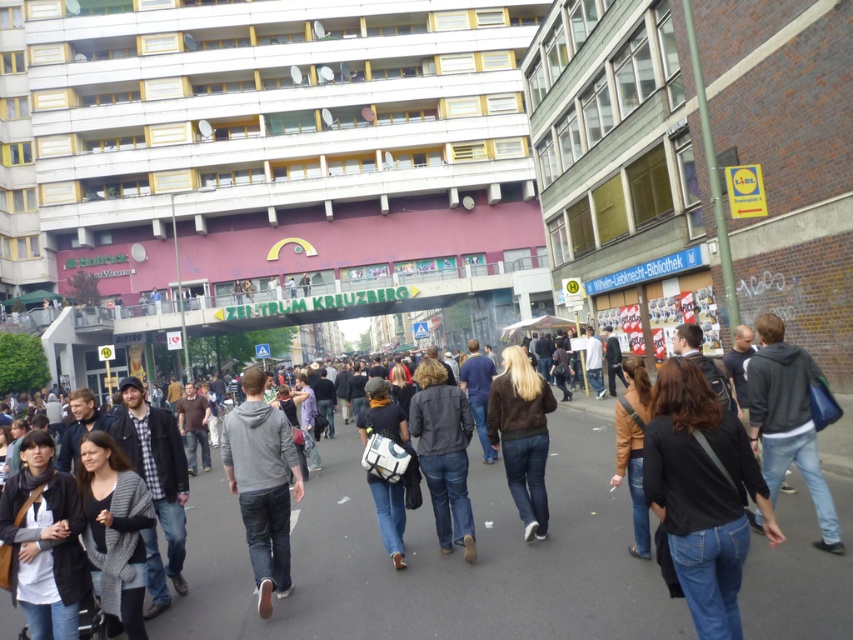
You are standing in the middle of the street in the image. There are two points marked on the ground in front of you. The first point is at coordinates point [247,467] and the second is at point [126,529]. Which point is closer to your current position?

Point [126,529] is closer to your current position because it is closer to the camera than point [247,467], which is further away.

Based on the photo, you are a fashion designer observing two jackets in an urban setting. The dark gray hoodie at center and the brown suede jacket at center are both displayed in the scene. Which of these two jackets appears taller when viewed from the front?

The dark gray hoodie at center appears taller than the brown suede jacket at center.

You are a photographer standing on the street in Kreuzberg, Berlin, and you see the dark gray hoodie at center and the brown suede jacket at center. Which one is positioned more to the right side?

The dark gray hoodie at center is positioned more to the right side than the brown suede jacket at center.